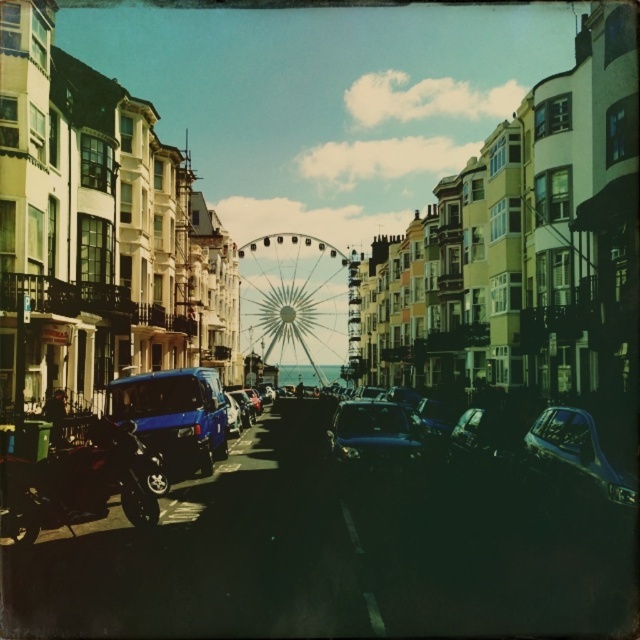
Question: Is shiny black motorcycle at lower left thinner than metallic blue van at center-left?

Choices:
 (A) yes
 (B) no

Answer: (A)

Question: Can you confirm if shiny blue car at center is thinner than shiny silver car at right?

Choices:
 (A) yes
 (B) no

Answer: (B)

Question: Which of the following is the closest to the observer?

Choices:
 (A) (593, 424)
 (B) (92, 518)
 (C) (392, 456)
 (D) (150, 412)

Answer: (A)

Question: Can you confirm if metallic blue van at center-left is positioned above shiny blue car at center?

Choices:
 (A) yes
 (B) no

Answer: (A)

Question: Which is farther from the shiny black motorcycle at lower left?

Choices:
 (A) metallic blue van at center-left
 (B) metallic silver ferris wheel at center
 (C) shiny silver car at right

Answer: (B)

Question: Which object is the closest to the shiny silver car at right?

Choices:
 (A) metallic blue van at center-left
 (B) shiny blue car at center

Answer: (B)